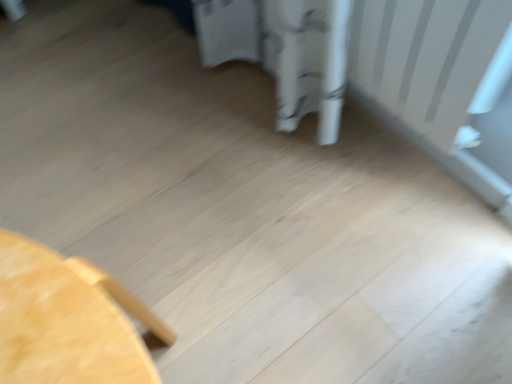
Question: From the image's perspective, relative to white matte radiator at upper right, is light wood table at lower left above or below?

Choices:
 (A) below
 (B) above

Answer: (A)

Question: From a real-world perspective, is light wood table at lower left above or below white matte radiator at upper right?

Choices:
 (A) below
 (B) above

Answer: (A)

Question: Considering the positions of light wood table at lower left and white matte radiator at upper right in the image, is light wood table at lower left wider or thinner than white matte radiator at upper right?

Choices:
 (A) wide
 (B) thin

Answer: (A)

Question: From a real-world perspective, relative to light wood table at lower left, is white matte radiator at upper right vertically above or below?

Choices:
 (A) below
 (B) above

Answer: (B)

Question: From the image's perspective, relative to light wood table at lower left, is white matte radiator at upper right above or below?

Choices:
 (A) below
 (B) above

Answer: (B)

Question: In the image, is white matte radiator at upper right positioned in front of or behind light wood table at lower left?

Choices:
 (A) front
 (B) behind

Answer: (B)

Question: Based on their positions, is white matte radiator at upper right located to the left or right of light wood table at lower left?

Choices:
 (A) right
 (B) left

Answer: (A)